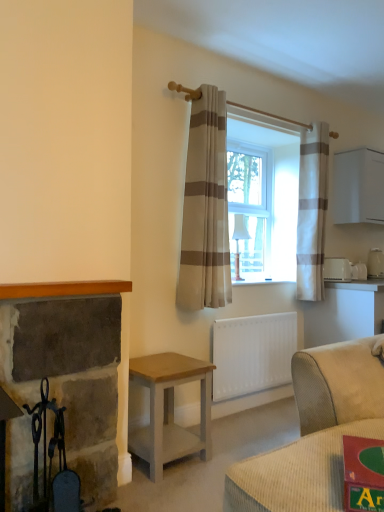
Question: Would you say beige striped curtain at center, positioned as the second curtain in right-to-left order, is to the left or to the right of white plastic toaster at right, which ranks as the third appliance in back-to-front order, in the picture?

Choices:
 (A) left
 (B) right

Answer: (A)

Question: From their relative heights in the image, would you say beige striped curtain at center, the 1th curtain positioned from the front, is taller or shorter than white plastic toaster at right, the third appliance positioned from the right?

Choices:
 (A) short
 (B) tall

Answer: (B)

Question: Which object is the closest to the white glossy toaster at upper right, marked as the second appliance in a back-to-front arrangement?

Choices:
 (A) white striped curtain at right, the 1th curtain in the back-to-front sequence
 (B) rustic stone fireplace at left
 (C) white plastic toaster at right, which ranks as the third appliance in back-to-front order
 (D) white matte radiator at lower center
 (E) beige striped curtain at center, positioned as the second curtain in right-to-left order

Answer: (C)

Question: Which of these objects is positioned farthest from the white plastic toaster at right, placed as the 3th appliance when sorted from front to back?

Choices:
 (A) rustic stone fireplace at left
 (B) white plastic toaster at right, which is counted as the first appliance, starting from the front
 (C) white glossy toaster at upper right, acting as the second appliance starting from the left
 (D) white matte radiator at lower center
 (E) light brown wood table at lower center

Answer: (A)